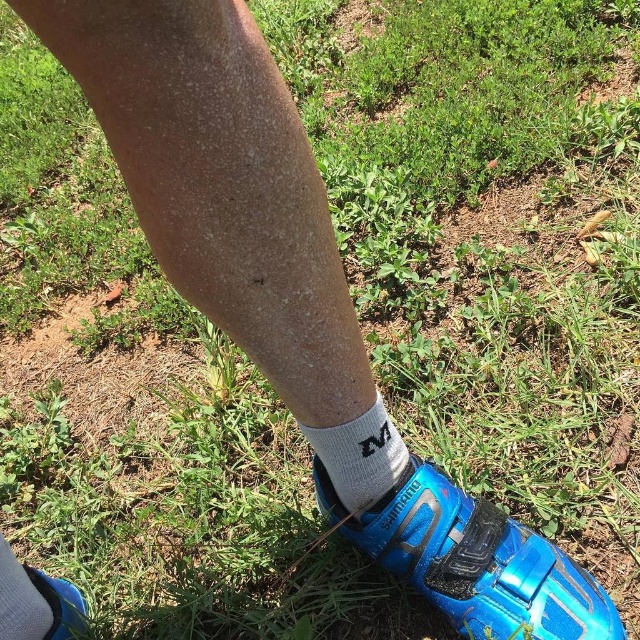
Who is positioned more to the right, white cotton sock at lower center or white cotton sock at lower left?

Positioned to the right is white cotton sock at lower center.

Measure the distance between white cotton sock at lower center and camera.

They are 29.82 inches apart.

Is point (378, 460) positioned after point (4, 602)?

No, it is in front of (4, 602).

You are a GUI agent. You are given a task and a screenshot of the screen. Output one action in this format:
    pyautogui.click(x=<x>, y=<y>)
    Task: Click on the white cotton sock at lower center
    This screenshot has height=640, width=640.
    Given the screenshot: What is the action you would take?
    tap(358, 456)

Does point (328, 520) lie behind point (33, 621)?

Yes, it is.

Image resolution: width=640 pixels, height=640 pixels. What do you see at coordinates (472, 561) in the screenshot? I see `blue matte shoe at lower center` at bounding box center [472, 561].

The height and width of the screenshot is (640, 640). What do you see at coordinates (472, 561) in the screenshot? I see `blue matte shoe at lower center` at bounding box center [472, 561].

You are a GUI agent. You are given a task and a screenshot of the screen. Output one action in this format:
    pyautogui.click(x=<x>, y=<y>)
    Task: Click on the blue matte shoe at lower center
    The height and width of the screenshot is (640, 640).
    Given the screenshot: What is the action you would take?
    pyautogui.click(x=472, y=561)

Who is more forward, (432, 531) or (76, 611)?

Point (432, 531) is more forward.

Between blue matte shoe at lower center and blue matte shoe at lower right, which one appears on the left side from the viewer's perspective?

Positioned to the left is blue matte shoe at lower right.

Which is in front, point (538, 611) or point (70, 582)?

Positioned in front is point (538, 611).

At what (x,y) coordinates should I click in order to perform the action: click on blue matte shoe at lower center. Please return your answer as a coordinate pair (x, y). The width and height of the screenshot is (640, 640). Looking at the image, I should click on 472,561.